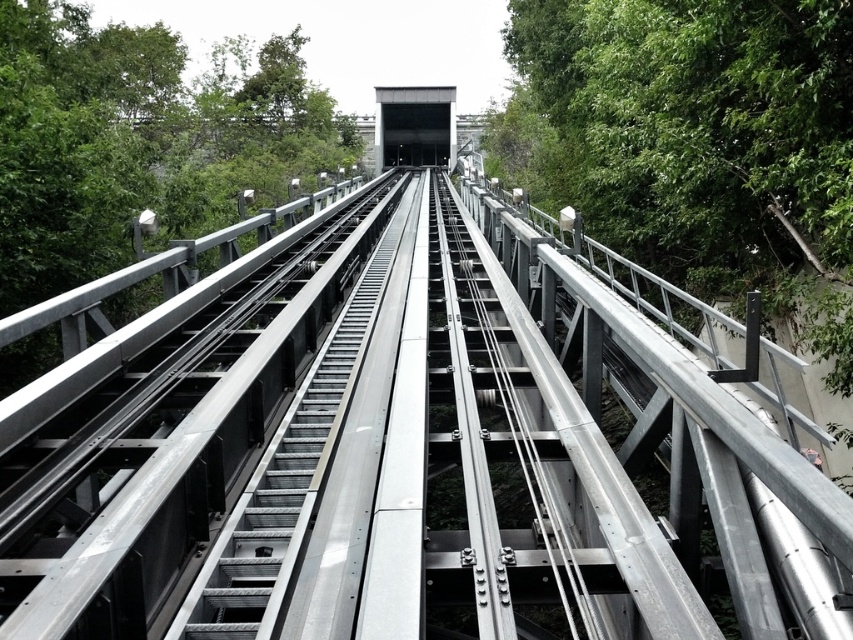
Question: Considering the relative positions of green leafy tree at right and metallic silver escalator at center in the image provided, where is green leafy tree at right located with respect to metallic silver escalator at center?

Choices:
 (A) left
 (B) right

Answer: (B)

Question: Which of the following is the farthest from the observer?

Choices:
 (A) green leafy tree at left
 (B) metallic silver escalator at center

Answer: (A)

Question: Is green leafy tree at left smaller than metallic silver escalator at center?

Choices:
 (A) no
 (B) yes

Answer: (A)

Question: Which point is farther from the camera taking this photo?

Choices:
 (A) (230, 532)
 (B) (560, 147)

Answer: (B)

Question: Which point is closer to the camera?

Choices:
 (A) (386, 237)
 (B) (105, 108)
 (C) (822, 376)

Answer: (C)

Question: Considering the relative positions of green leafy tree at left and metallic silver escalator at center in the image provided, where is green leafy tree at left located with respect to metallic silver escalator at center?

Choices:
 (A) above
 (B) below

Answer: (A)